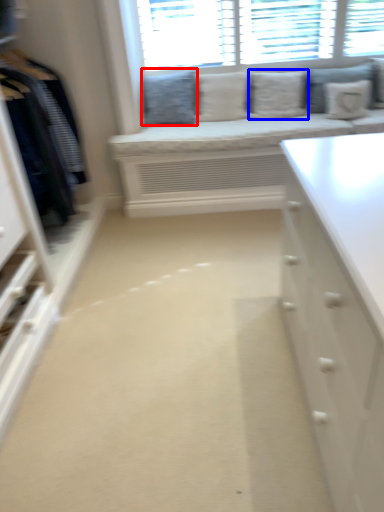
Question: Among these objects, which one is nearest to the camera, pillow (highlighted by a red box) or pillow (highlighted by a blue box)?

Choices:
 (A) pillow
 (B) pillow

Answer: (B)